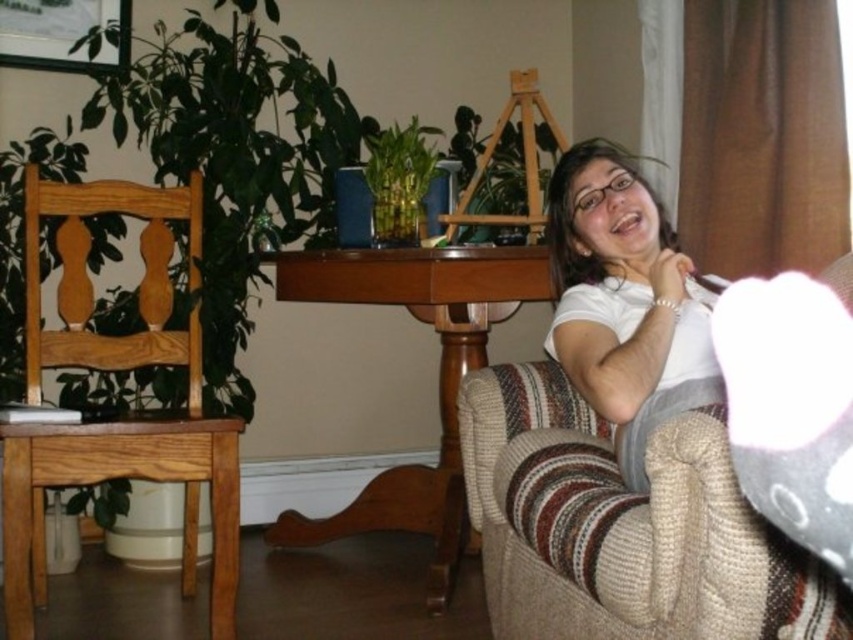
Question: Which point is closer to the camera?

Choices:
 (A) (210, 445)
 (B) (526, 576)

Answer: (B)

Question: Which of the following is the closest to the observer?

Choices:
 (A) knitted beige couch at lower right
 (B) light brown wooden chair at left
 (C) white matte shirt at center

Answer: (A)

Question: Does light brown wooden chair at left have a smaller size compared to white matte shirt at center?

Choices:
 (A) no
 (B) yes

Answer: (A)

Question: Is light brown wooden chair at left further to the viewer compared to white matte shirt at center?

Choices:
 (A) no
 (B) yes

Answer: (B)

Question: Does knitted beige couch at lower right appear on the left side of light brown wooden chair at left?

Choices:
 (A) no
 (B) yes

Answer: (A)

Question: Which point is closer to the camera taking this photo?

Choices:
 (A) (682, 612)
 (B) (144, 285)

Answer: (A)